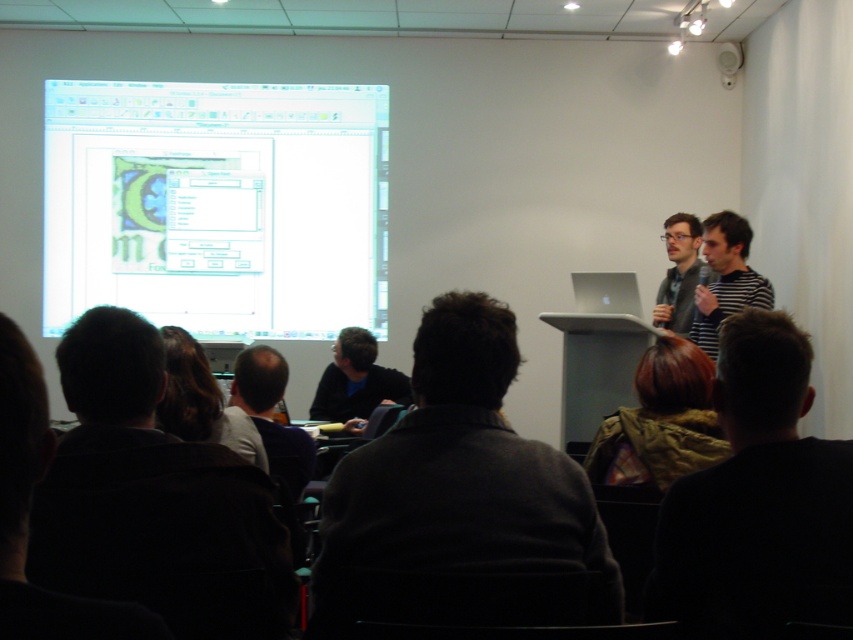
Question: Can you confirm if dark gray sweater at center is wider than striped shirt at right?

Choices:
 (A) no
 (B) yes

Answer: (B)

Question: Is dark blue shirt at center behind dark gray shirt at lower center?

Choices:
 (A) no
 (B) yes

Answer: (B)

Question: Does dark gray sweater at center have a lesser width compared to shiny brown hair at center?

Choices:
 (A) yes
 (B) no

Answer: (B)

Question: Which point is farther to the camera?

Choices:
 (A) matte black laptop at right
 (B) dark brown hair at lower right
 (C) matte plastic projector screen at upper left
 (D) dark blue shirt at center

Answer: (C)

Question: Which object is farther from the camera taking this photo?

Choices:
 (A) matte black laptop at right
 (B) dark brown hair at lower right

Answer: (A)

Question: Which point is farther from the camera taking this photo?

Choices:
 (A) (550, 545)
 (B) (231, 400)

Answer: (B)